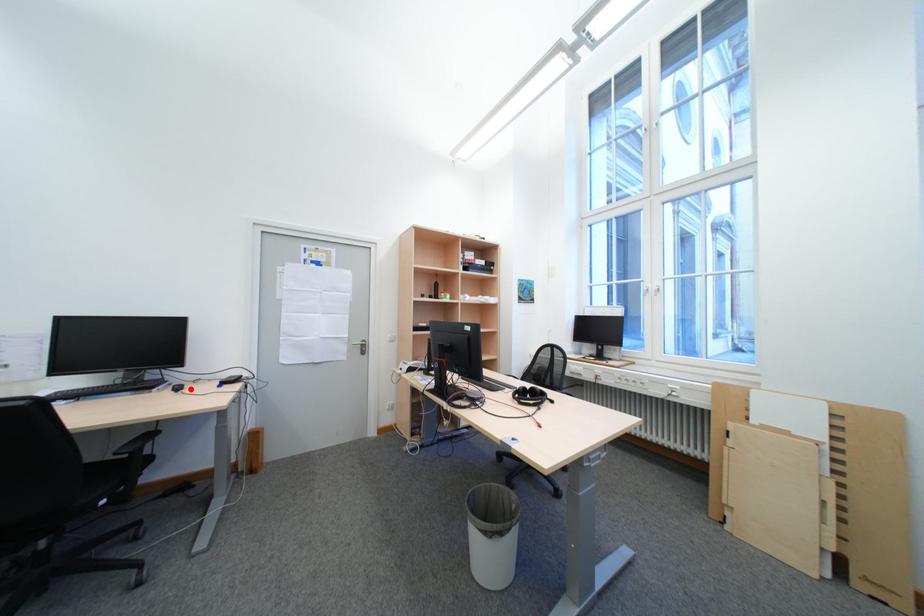
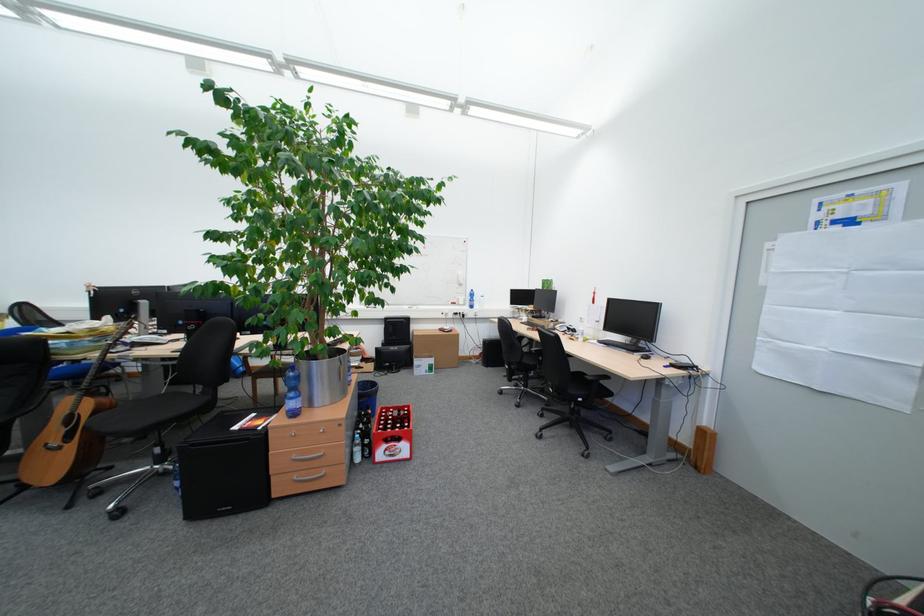
Find the pixel in the second image that matches the highlighted location in the first image.

(658, 359)